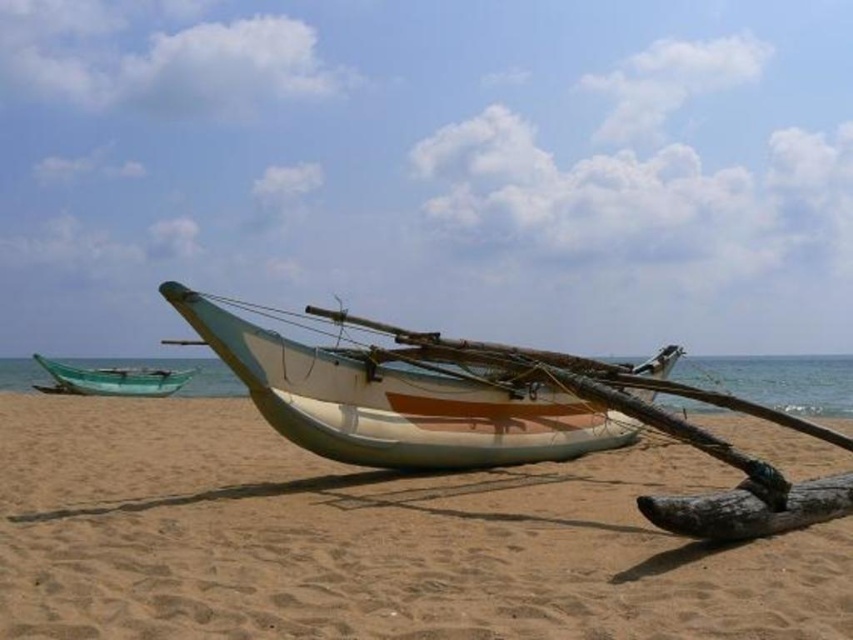
Question: Which point appears closest to the camera in this image?

Choices:
 (A) (177, 291)
 (B) (169, 381)

Answer: (A)

Question: Can you confirm if sandy brown sand at center is thinner than brown wood log at lower right?

Choices:
 (A) no
 (B) yes

Answer: (A)

Question: Which of the following is the closest to the observer?

Choices:
 (A) green plastic boat at left
 (B) white matte boat at center

Answer: (B)

Question: Where is white matte boat at center located in relation to brown wood log at lower right in the image?

Choices:
 (A) above
 (B) below

Answer: (A)

Question: Which point is closer to the camera?

Choices:
 (A) (728, 630)
 (B) (699, 522)
 (C) (462, 403)

Answer: (A)

Question: Does sandy brown sand at center appear over brown wood log at lower right?

Choices:
 (A) yes
 (B) no

Answer: (B)